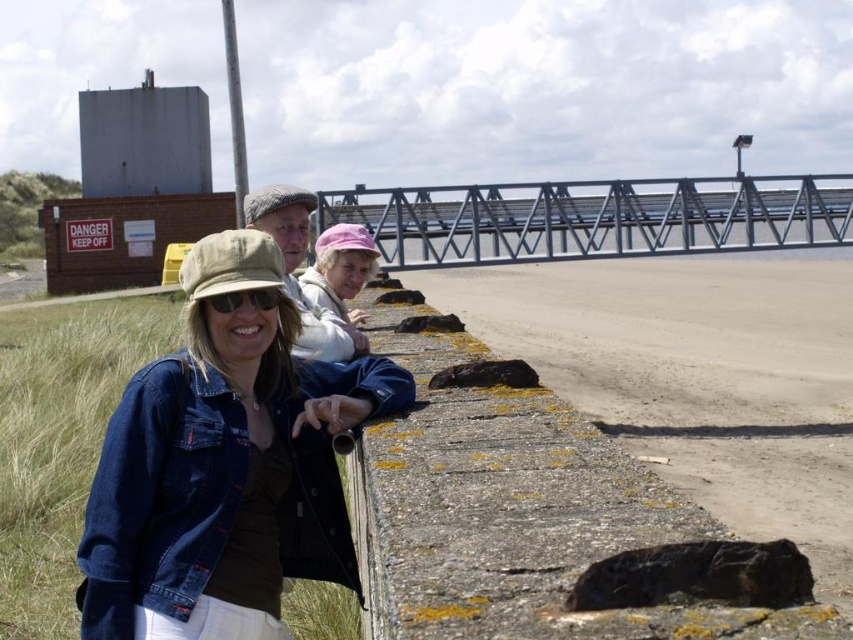
Between point (850, 234) and point (222, 298), which one is positioned behind?

Positioned behind is point (850, 234).

In order to click on metallic steel bridge at upper center in this screenshot , I will do `click(593, 218)`.

Between light brown woolen cap at center and pink fabric cap at center, which one is positioned higher?

pink fabric cap at center

What do you see at coordinates (297, 268) in the screenshot? I see `light brown woolen cap at center` at bounding box center [297, 268].

Identify the location of light brown woolen cap at center. (297, 268).

Does denim jacket at lower left appear over pink fabric cap at center?

Incorrect, denim jacket at lower left is not positioned above pink fabric cap at center.

Who is taller, denim jacket at lower left or pink fabric cap at center?

denim jacket at lower left is taller.

Who is more forward, (308,500) or (312,269)?

Point (308,500) is in front.

Where is `denim jacket at lower left`? This screenshot has height=640, width=853. denim jacket at lower left is located at coordinates (225, 467).